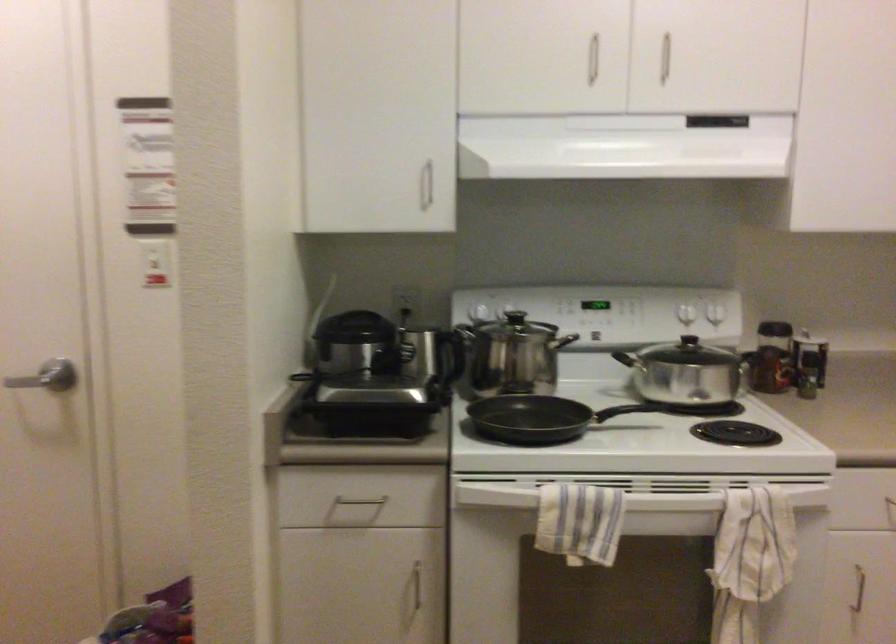
Find where to pull the silver drawer handle. Please return your answer as a coordinate pair (x, y).

(359, 500)